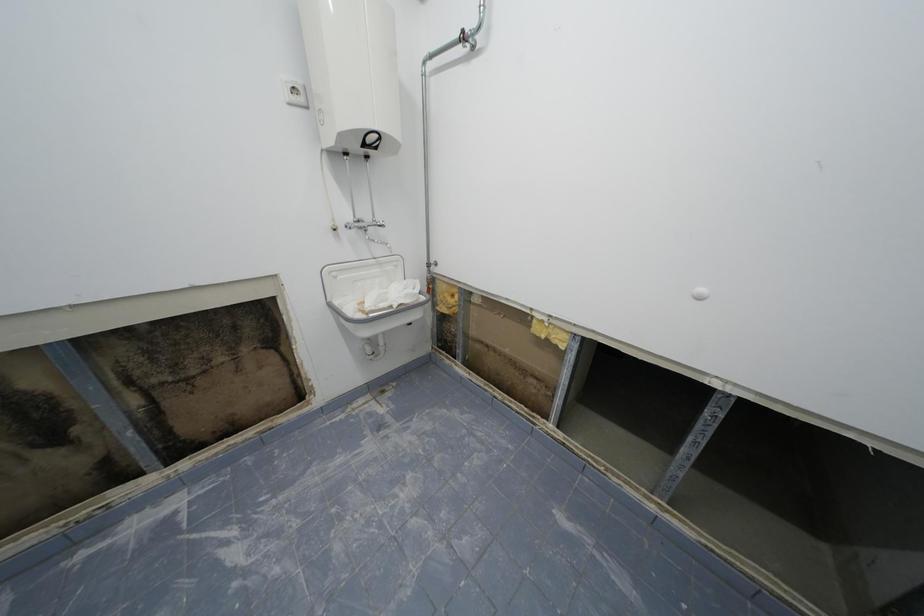
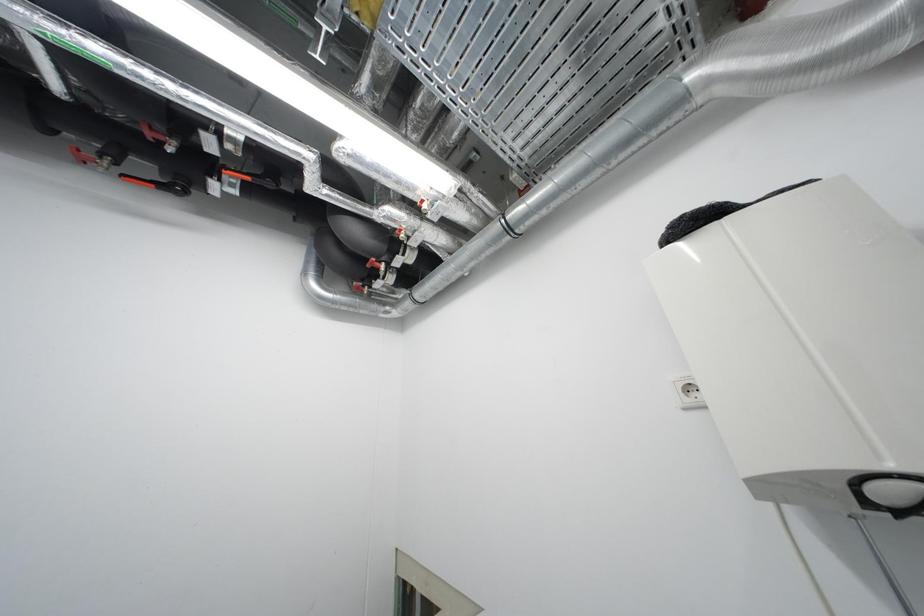
First-person continuous shooting, in which direction is the camera rotating?

The rotation direction of the camera is left-up.